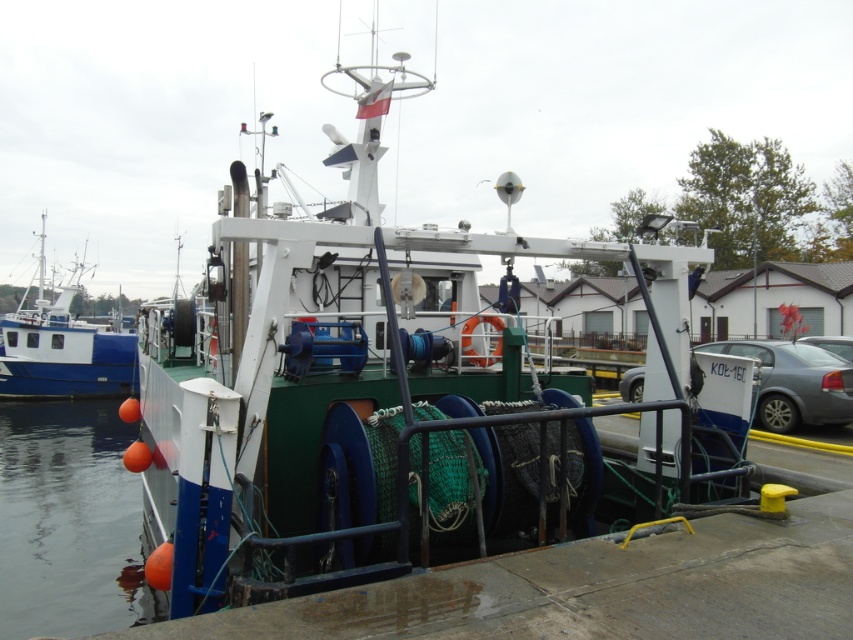
You are standing on the deck of the fishing vessel and want to move from point A to point B. Point A is located at coordinates point (x=53, y=301) and point B is at point (x=630, y=388). Since you need to avoid obstacles, which point should you start from to have a clearer path towards the front of the boat?

Point A at (x=53, y=301) is closer to you, so starting from there would provide a clearer path towards the front of the boat since it is closer and less obstructed compared to point B at (x=630, y=388) which is further away.

You are standing on the deck of the fishing vessel and want to move from point A to point B. Point A is at coordinate point (79, 582) and point B is at coordinate point (836, 419). Which point is closer to you when you start at point A?

Point A at coordinate point (79, 582) is your starting position, so it is closer to you than point B at coordinate point (836, 419).

You are standing on the pier and see the green matte boat at center and the orange rubber buoy at lower left. Which object is positioned to the left?

The orange rubber buoy at lower left is positioned to the left of the green matte boat at center.